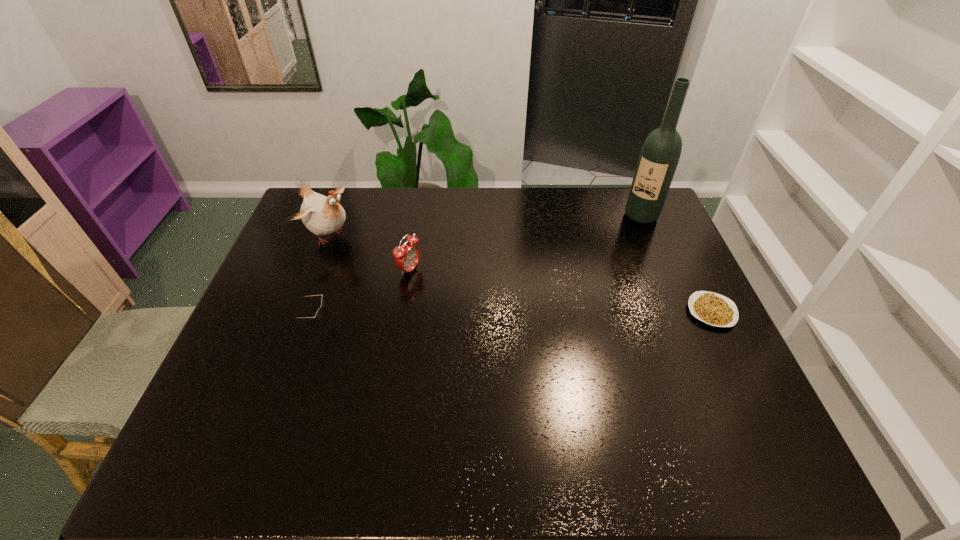
What are the coordinates of `vacant space located on the labeled side of the tallest object` in the screenshot? It's located at (590, 284).

The width and height of the screenshot is (960, 540). Identify the location of vacant space situated on the face of the alarm clock. (539, 329).

You are a GUI agent. You are given a task and a screenshot of the screen. Output one action in this format:
    pyautogui.click(x=<x>, y=<y>)
    Task: Click on the free space located on the face of the alarm clock
    The height and width of the screenshot is (540, 960).
    Given the screenshot: What is the action you would take?
    pyautogui.click(x=436, y=284)

Locate an element on the screen. Image resolution: width=960 pixels, height=540 pixels. free spot located on the face of the alarm clock is located at coordinates (465, 296).

The height and width of the screenshot is (540, 960). I want to click on free point located 0.130m at the beak of the bird, so click(377, 262).

Find the location of a particular element. This screenshot has height=540, width=960. free space located at the beak of the bird is located at coordinates (390, 269).

Identify the location of free space located 0.060m at the beak of the bird. Image resolution: width=960 pixels, height=540 pixels. (361, 254).

The image size is (960, 540). I want to click on wine bottle that is at the far edge, so click(x=661, y=150).

I want to click on bird that is positioned at the far edge, so click(322, 215).

Locate an element on the screen. Image resolution: width=960 pixels, height=540 pixels. sunglasses present at the left edge is located at coordinates (318, 314).